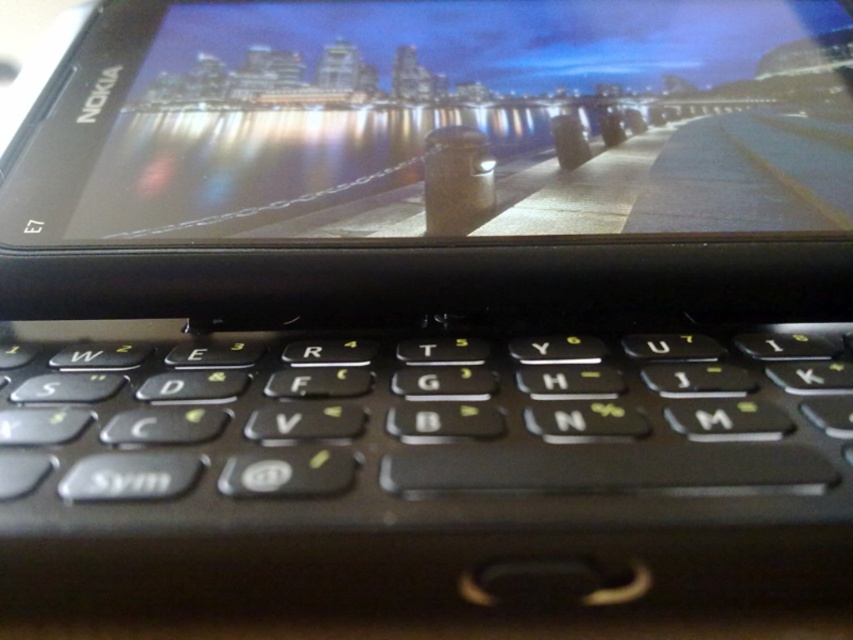
Consider the image. Who is positioned more to the right, black plastic keyboard at center or matte black screen at upper center?

Positioned to the right is matte black screen at upper center.

Who is more distant from viewer, (793, 333) or (704, 140)?

The point (704, 140) is behind.

Between point (412, 582) and point (360, 67), which one is positioned behind?

Positioned behind is point (360, 67).

The height and width of the screenshot is (640, 853). Identify the location of black plastic keyboard at center. (421, 458).